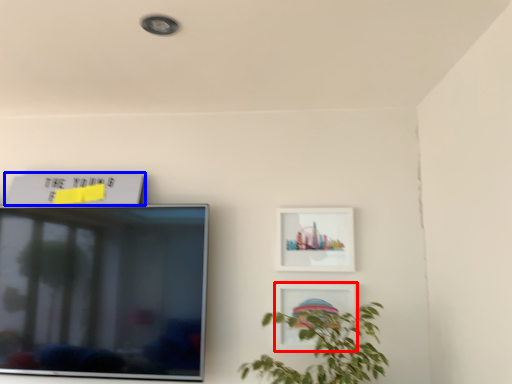
Question: Which of the following is the farthest to the observer, picture frame (highlighted by a red box) or picture frame (highlighted by a blue box)?

Choices:
 (A) picture frame
 (B) picture frame

Answer: (B)